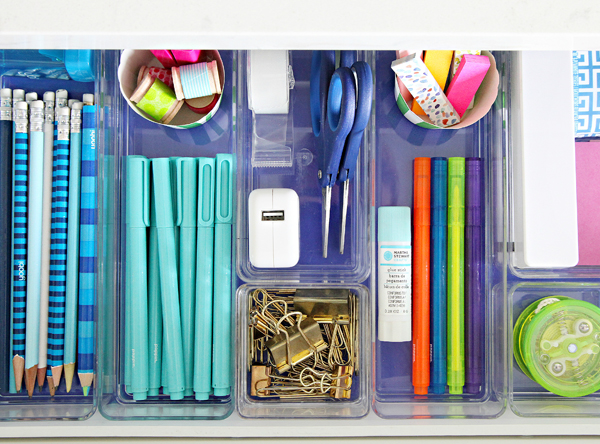
Find the location of `plastic trays`. plastic trays is located at coordinates (60, 75), (185, 144), (304, 103), (354, 389), (386, 360), (591, 271), (516, 302).